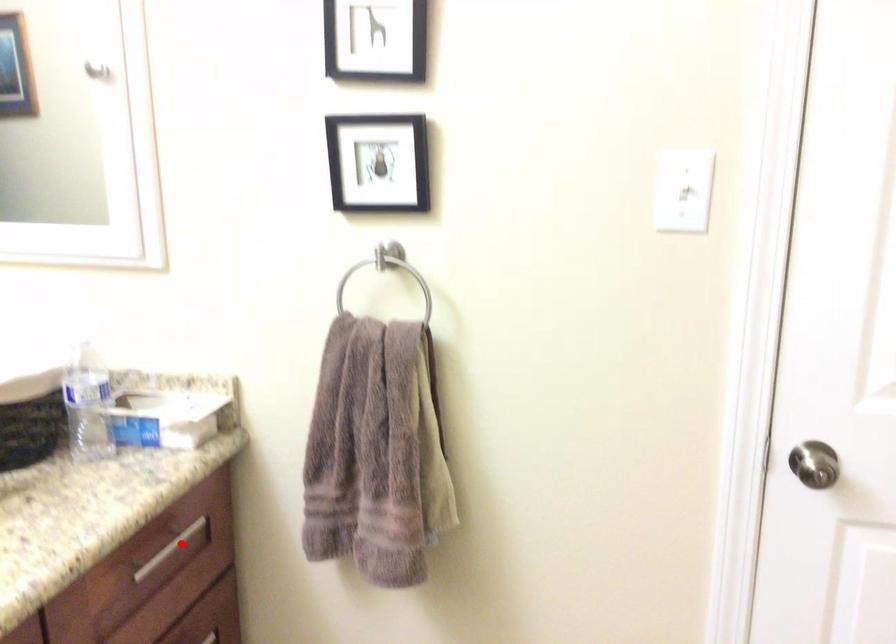
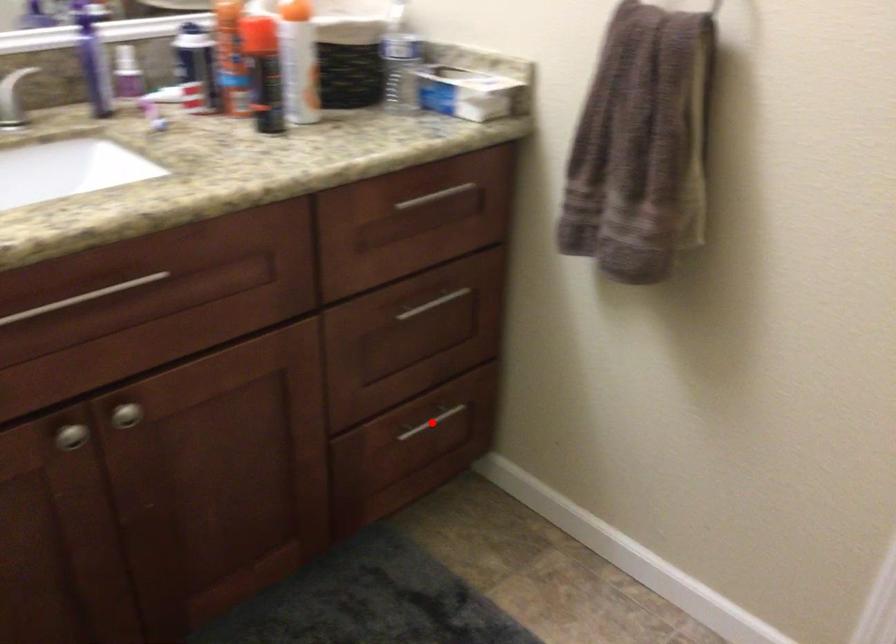
I am providing you with two images of the same scene from different viewpoints. A red point is marked on the first image and another point is marked on the second image. Do the highlighted points in image1 and image2 indicate the same real-world spot?

No